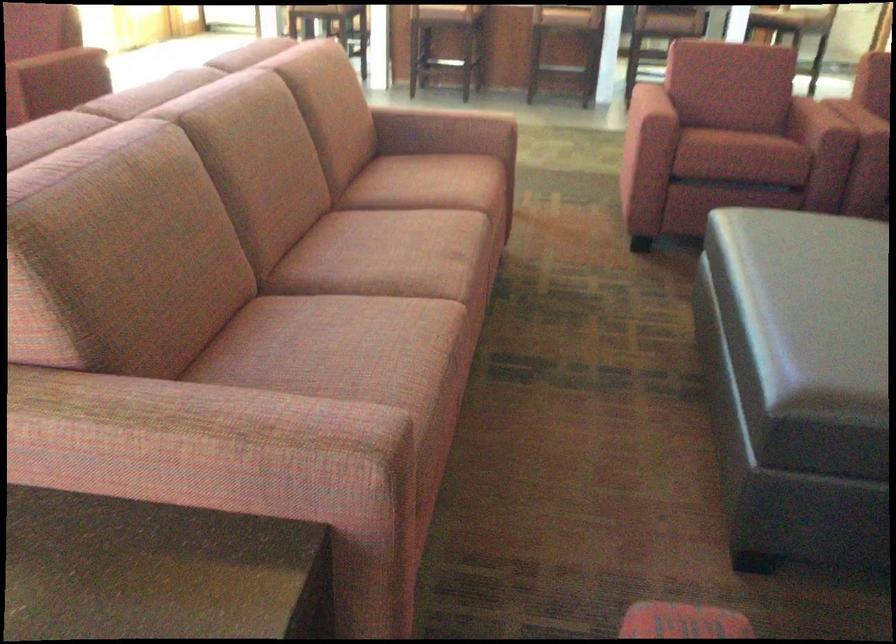
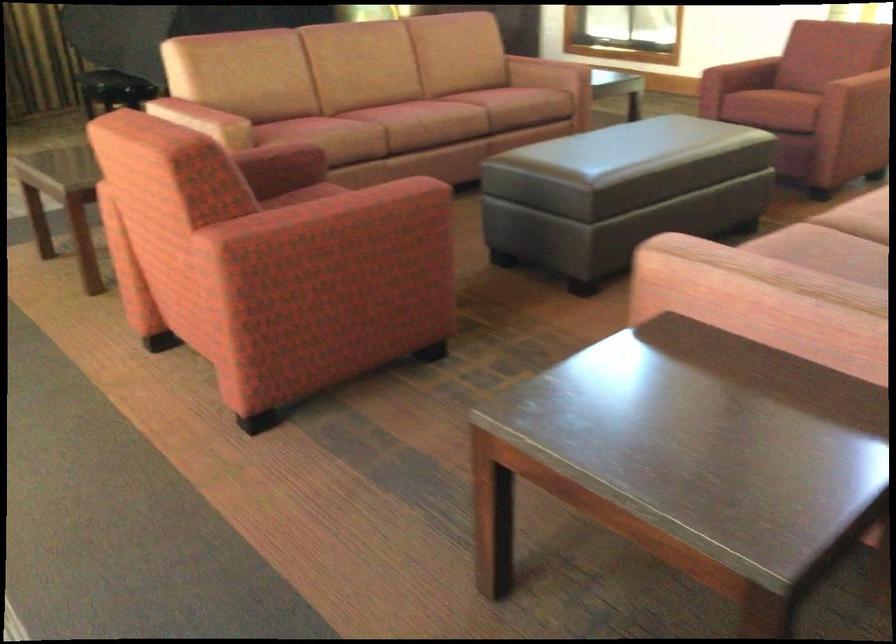
Question: The images are taken continuously from a first-person perspective. In which direction is your viewpoint rotating?

Choices:
 (A) Left
 (B) Right
 (C) Up
 (D) Down

Answer: (A)